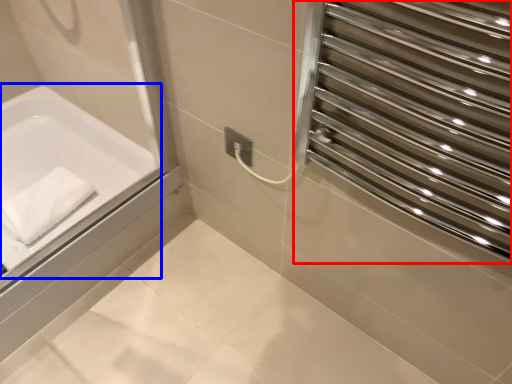
Question: Which point is further to the camera, screen door (highlighted by a red box) or bathtub (highlighted by a blue box)?

Choices:
 (A) screen door
 (B) bathtub

Answer: (B)